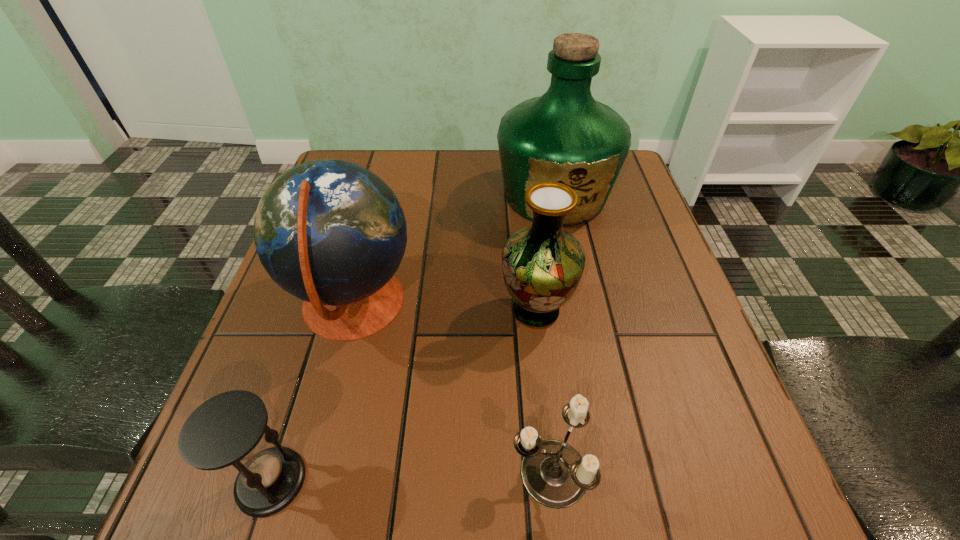
Where is `vacant area at the left edge`? vacant area at the left edge is located at coordinates (313, 339).

I want to click on blank area at the right edge, so (x=630, y=328).

What are the coordinates of `free point at the far left corner` in the screenshot? It's located at (373, 159).

Find the location of `free space between the vase and the hourglass`. free space between the vase and the hourglass is located at coordinates (403, 396).

Locate an element on the screen. The width and height of the screenshot is (960, 540). blank region between the hourglass and the shortest object is located at coordinates (410, 477).

The height and width of the screenshot is (540, 960). I want to click on free space between the globe and the vase, so click(x=444, y=308).

Locate an element on the screen. The height and width of the screenshot is (540, 960). free space between the hourglass and the vase is located at coordinates (403, 396).

This screenshot has height=540, width=960. I want to click on vacant point located between the vase and the candle holder, so click(x=542, y=392).

What are the coordinates of `free spot between the globe and the vase` in the screenshot? It's located at (444, 308).

Image resolution: width=960 pixels, height=540 pixels. Find the location of `empty space between the candle holder and the farthest object`. empty space between the candle holder and the farthest object is located at coordinates (552, 334).